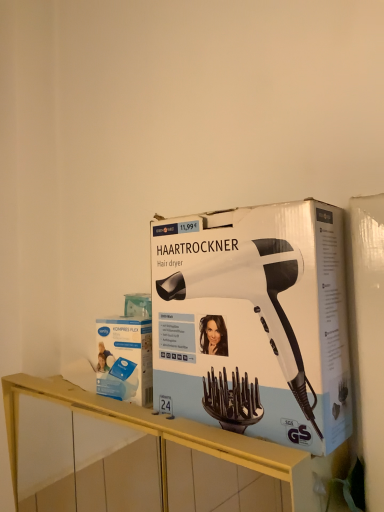
Question: Is white/black plastic hair dryer at center directly adjacent to blue cardboard box at center?

Choices:
 (A) yes
 (B) no

Answer: (B)

Question: Is white/black plastic hair dryer at center thinner than blue cardboard box at center?

Choices:
 (A) no
 (B) yes

Answer: (A)

Question: Is white/black plastic hair dryer at center further to camera compared to blue cardboard box at center?

Choices:
 (A) yes
 (B) no

Answer: (B)

Question: Can you confirm if white/black plastic hair dryer at center is taller than blue cardboard box at center?

Choices:
 (A) yes
 (B) no

Answer: (A)

Question: Are white/black plastic hair dryer at center and blue cardboard box at center located far from each other?

Choices:
 (A) no
 (B) yes

Answer: (A)

Question: In terms of width, does white/black plastic hair dryer at center look wider or thinner when compared to blue cardboard box at center?

Choices:
 (A) wide
 (B) thin

Answer: (A)

Question: From the image's perspective, is white/black plastic hair dryer at center positioned above or below blue cardboard box at center?

Choices:
 (A) below
 (B) above

Answer: (B)

Question: Is white/black plastic hair dryer at center taller or shorter than blue cardboard box at center?

Choices:
 (A) tall
 (B) short

Answer: (A)

Question: Considering their positions, is white/black plastic hair dryer at center located in front of or behind blue cardboard box at center?

Choices:
 (A) behind
 (B) front

Answer: (B)

Question: Is yellow wood shelf at center bigger or smaller than white/black plastic hair dryer at center?

Choices:
 (A) small
 (B) big

Answer: (B)

Question: Is yellow wood shelf at center wider or thinner than white/black plastic hair dryer at center?

Choices:
 (A) wide
 (B) thin

Answer: (A)

Question: Considering the positions of yellow wood shelf at center and white/black plastic hair dryer at center in the image, is yellow wood shelf at center taller or shorter than white/black plastic hair dryer at center?

Choices:
 (A) short
 (B) tall

Answer: (B)

Question: In the image, is yellow wood shelf at center on the left side or the right side of white/black plastic hair dryer at center?

Choices:
 (A) right
 (B) left

Answer: (B)

Question: Is white/black plastic hair dryer at center situated inside yellow wood shelf at center or outside?

Choices:
 (A) inside
 (B) outside

Answer: (B)

Question: From a real-world perspective, is white/black plastic hair dryer at center above or below yellow wood shelf at center?

Choices:
 (A) above
 (B) below

Answer: (A)